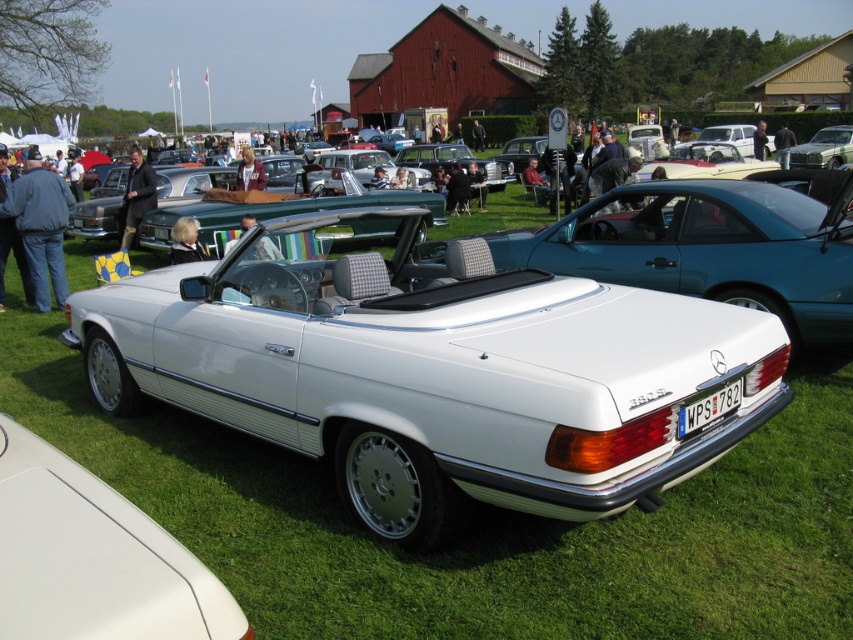
You are a photographer at the car show and want to take a photo that includes both the gray jacket at left and the leather jacket at center. Since you want to emphasize the size difference between them, where should you position yourself relative to the jackets to make the smaller one appear larger in the photo?

To make the gray jacket at left appear larger despite its smaller size, position yourself closer to it while keeping the leather jacket at center farther away in the frame. This perspective will exaggerate the size difference, making the gray jacket at left look bigger in comparison.